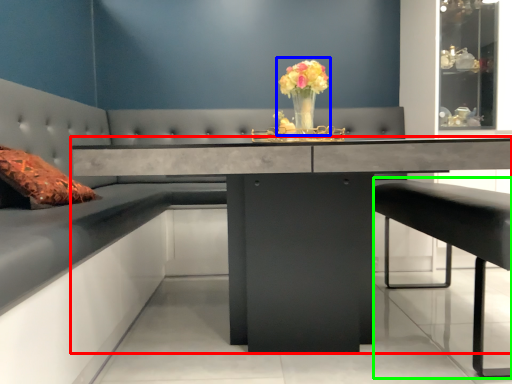
Question: Considering the real-world distances, which object is farthest from table (highlighted by a red box)? floral arrangement (highlighted by a blue box) or bar stool (highlighted by a green box)?

Choices:
 (A) floral arrangement
 (B) bar stool

Answer: (B)